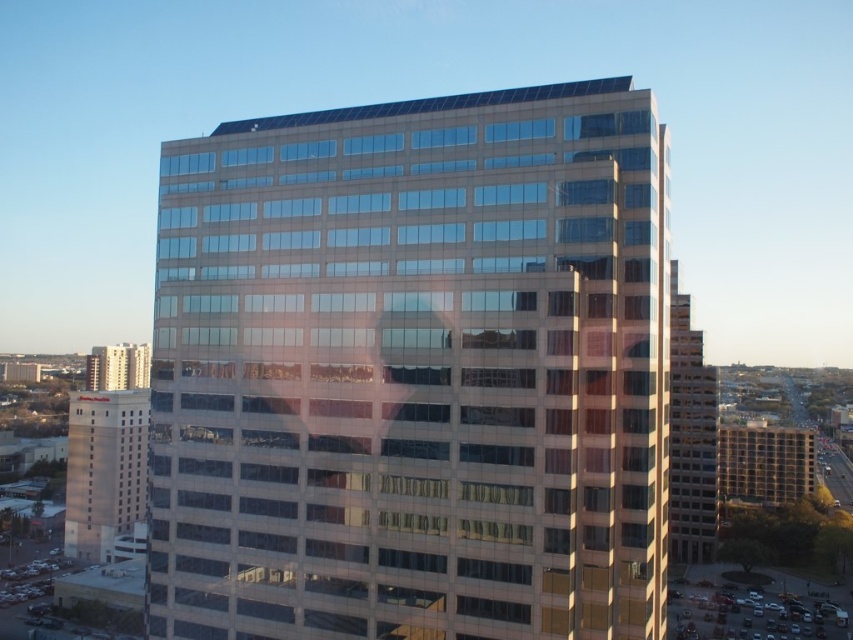
Question: Where is beige concrete building at right located in relation to matte glass building at left in the image?

Choices:
 (A) right
 (B) left

Answer: (A)

Question: Which point is closer to the camera?

Choices:
 (A) matte glass building at left
 (B) beige concrete building at right
 (C) glassy beige building at center

Answer: (C)

Question: Which point is farther from the camera taking this photo?

Choices:
 (A) (105, 348)
 (B) (688, 504)

Answer: (A)

Question: Does beige concrete hotel at lower left appear over matte glass building at left?

Choices:
 (A) yes
 (B) no

Answer: (B)

Question: Which object is closer to the camera taking this photo?

Choices:
 (A) glassy beige building at center
 (B) beige concrete hotel at lower left

Answer: (A)

Question: Is glassy beige building at center wider than beige concrete hotel at lower left?

Choices:
 (A) yes
 (B) no

Answer: (B)